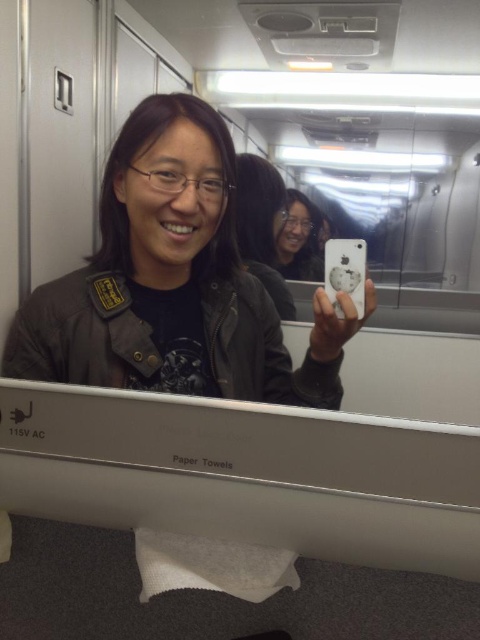
You are standing in a public restroom and want to take a selfie with your iPhone. The camera is positioned at point (238, 300). If the recommended distance for a perfect selfie is between 12 to 18 inches, is the current distance too far or too close?

The point (238, 300) is 31.32 inches away from the camera, which is outside the recommended 12 to 18 inch range. This means the current distance is too far for a perfect selfie.

You are a photographer trying to capture a candid shot of the person in the restroom. The person is holding a matte black phone at center and wearing a matte black jacket at center. Based on their positions, which object is closer to the floor?

The matte black jacket at center is located below the matte black phone at center, so the jacket is closer to the floor.